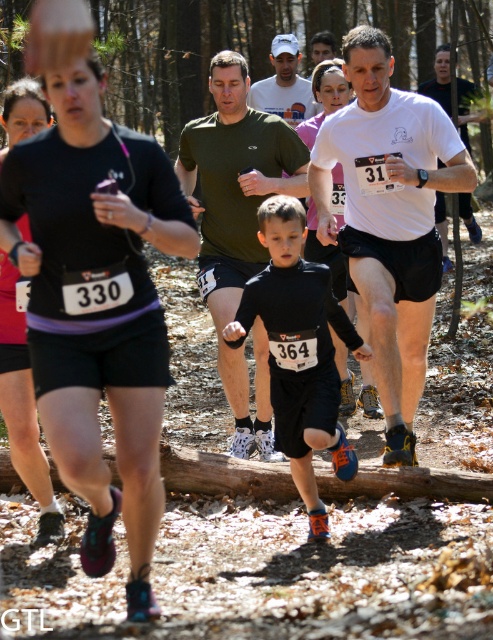
Question: Which point is closer to the camera?

Choices:
 (A) matte green t-shirt at center
 (B) white matte t-shirt at center
 (C) white matte shirt at upper center

Answer: (B)

Question: Can you confirm if black matte shorts at left is positioned above matte black shorts at left?

Choices:
 (A) no
 (B) yes

Answer: (B)

Question: Does white matte t-shirt at center have a smaller size compared to white matte shirt at upper center?

Choices:
 (A) yes
 (B) no

Answer: (B)

Question: Considering the real-world distances, which object is farthest from the white matte t-shirt at center?

Choices:
 (A) black matte shorts at left
 (B) black matte running suit at center
 (C) white matte shirt at upper center
 (D) matte green t-shirt at center

Answer: (C)

Question: Is matte green t-shirt at center below black matte running suit at center?

Choices:
 (A) no
 (B) yes

Answer: (A)

Question: Considering the real-world distances, which object is closest to the black matte running suit at center?

Choices:
 (A) matte green t-shirt at center
 (B) matte black shorts at left

Answer: (A)